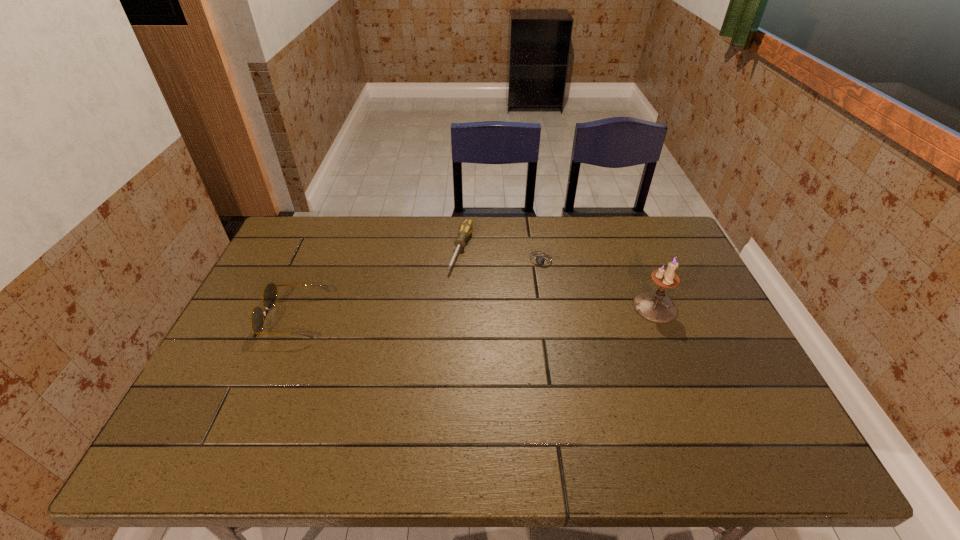
The width and height of the screenshot is (960, 540). Find the location of `vacant point located between the sunglasses and the screwdriver`. vacant point located between the sunglasses and the screwdriver is located at coordinates (378, 284).

Locate an element on the screen. The height and width of the screenshot is (540, 960). free space between the second object from right to left and the rightmost object is located at coordinates (599, 284).

The width and height of the screenshot is (960, 540). Find the location of `empty space between the third shortest object and the rightmost object`. empty space between the third shortest object and the rightmost object is located at coordinates (475, 313).

Locate which object is the second closest to the leftmost object. Please provide its 2D coordinates. Your answer should be formatted as a tuple, i.e. [(x, y)], where the tuple contains the x and y coordinates of a point satisfying the conditions above.

[(540, 260)]

Identify which object is the third closest to the second object from right to left. Please provide its 2D coordinates. Your answer should be formatted as a tuple, i.e. [(x, y)], where the tuple contains the x and y coordinates of a point satisfying the conditions above.

[(270, 291)]

Locate an element on the screen. vacant space that satisfies the following two spatial constraints: 1. on the front side of the screwdriver; 2. on the right side of the third object from left to right is located at coordinates (461, 260).

In order to click on blank space that satisfies the following two spatial constraints: 1. on the front side of the second shortest object; 2. on the left side of the candle holder in this screenshot , I will do `click(459, 307)`.